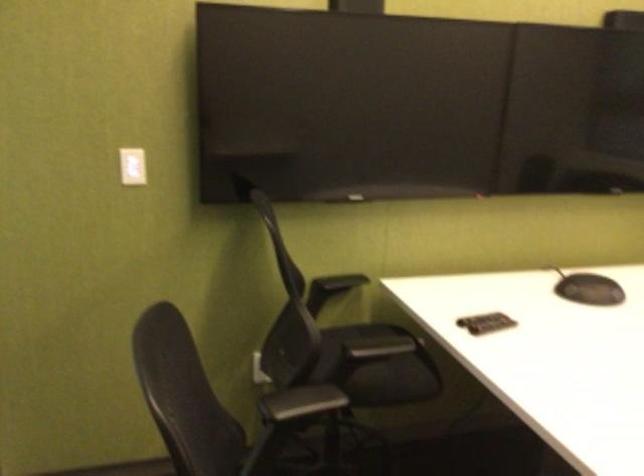
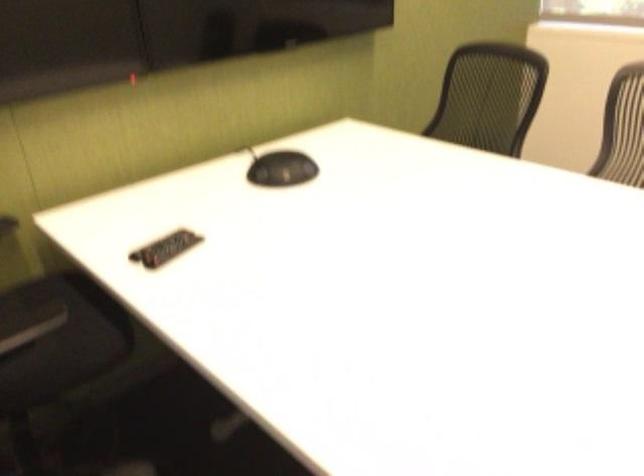
Question: Based on the continuous images, in which direction is the camera rotating? Reply with the corresponding letter.

Choices:
 (A) Left
 (B) Right
 (C) Up
 (D) Down

Answer: (B)